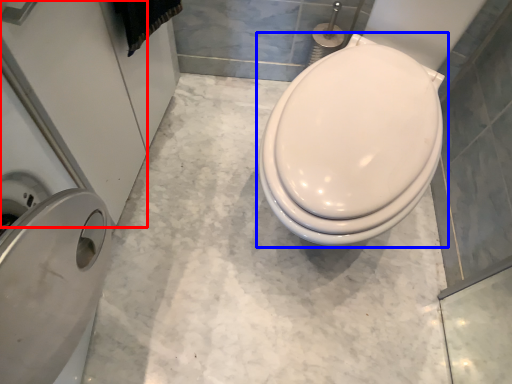
Question: Which object is further to the camera taking this photo, screen door (highlighted by a red box) or toilet (highlighted by a blue box)?

Choices:
 (A) screen door
 (B) toilet

Answer: (B)